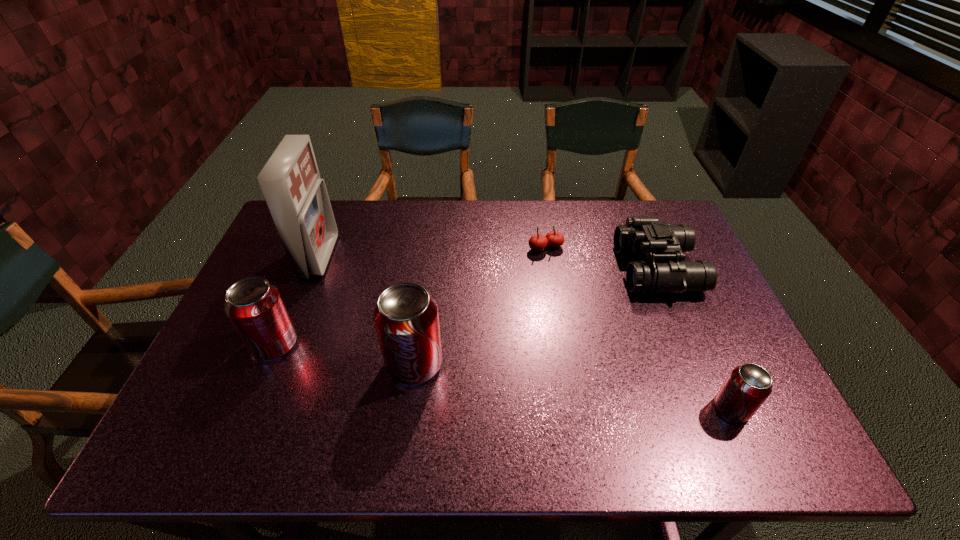
I want to click on free area in between the nearest object and the cherry, so click(x=638, y=328).

Find the location of a particular element. This screenshot has height=540, width=960. vacant region between the second shortest object and the fourth object from right to left is located at coordinates (573, 386).

Find the location of a particular element. The height and width of the screenshot is (540, 960). object that is the second closest one to the binoculars is located at coordinates (747, 387).

This screenshot has height=540, width=960. What are the coordinates of `object that ranks as the third closest to the binoculars` in the screenshot? It's located at (406, 319).

Where is `the second closest soda can to the tallest object`? the second closest soda can to the tallest object is located at coordinates (406, 319).

Identify which soda can is the second nearest to the third object from left to right. Please provide its 2D coordinates. Your answer should be formatted as a tuple, i.e. [(x, y)], where the tuple contains the x and y coordinates of a point satisfying the conditions above.

[(747, 387)]

You are a GUI agent. You are given a task and a screenshot of the screen. Output one action in this format:
    pyautogui.click(x=<x>, y=<y>)
    Task: Click on the free space that satisfies the following two spatial constraints: 1. on the back side of the second shortest soda can; 2. on the left side of the cherry
    This screenshot has height=540, width=960.
    Given the screenshot: What is the action you would take?
    (x=314, y=248)

This screenshot has height=540, width=960. I want to click on vacant space that satisfies the following two spatial constraints: 1. on the front-facing side of the first-aid kit; 2. on the left side of the rightmost soda can, so click(260, 409).

Where is `vacant area in the image that satisfies the following two spatial constraints: 1. on the back side of the third object from right to left; 2. on the right side of the fourth shortest object`? vacant area in the image that satisfies the following two spatial constraints: 1. on the back side of the third object from right to left; 2. on the right side of the fourth shortest object is located at coordinates (314, 248).

The width and height of the screenshot is (960, 540). In order to click on vacant space that satisfies the following two spatial constraints: 1. on the front-facing side of the second soda can from left to right; 2. on the left side of the tallest object in this screenshot , I will do `click(277, 364)`.